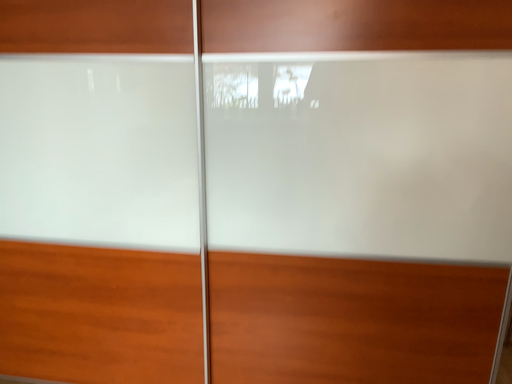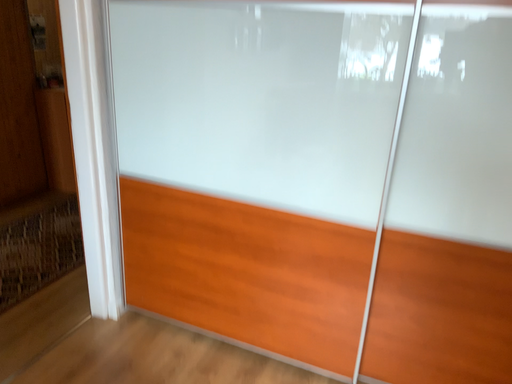
Question: Which way did the camera rotate in the video?

Choices:
 (A) rotated right
 (B) rotated left

Answer: (B)